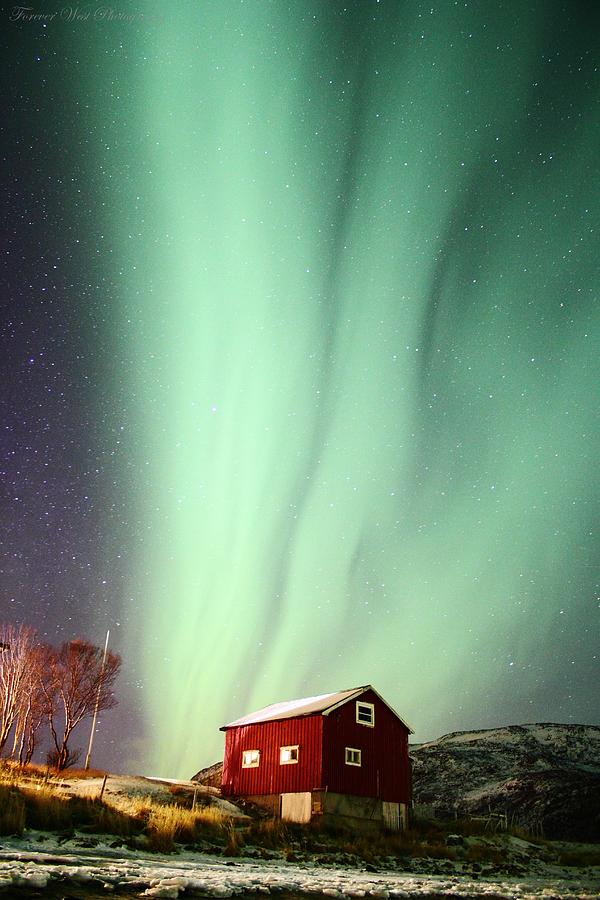
Find the location of a particular element. This screenshot has width=600, height=900. side windows is located at coordinates (249, 756), (286, 752).